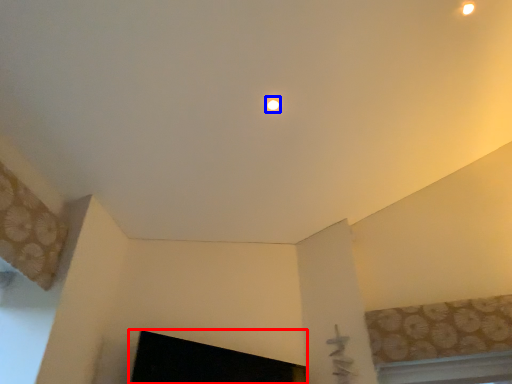
Question: Which of the following is the farthest to the observer, fireplace (highlighted by a red box) or lighting (highlighted by a blue box)?

Choices:
 (A) fireplace
 (B) lighting

Answer: (B)